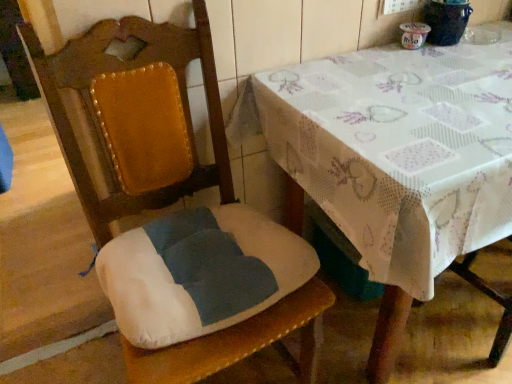
At what (x,y) coordinates should I click in order to perform the action: click on vacant space situated above white printed tablecloth at upper right (from a real-world perspective). Please return your answer as a coordinate pair (x, y). Looking at the image, I should click on (420, 92).